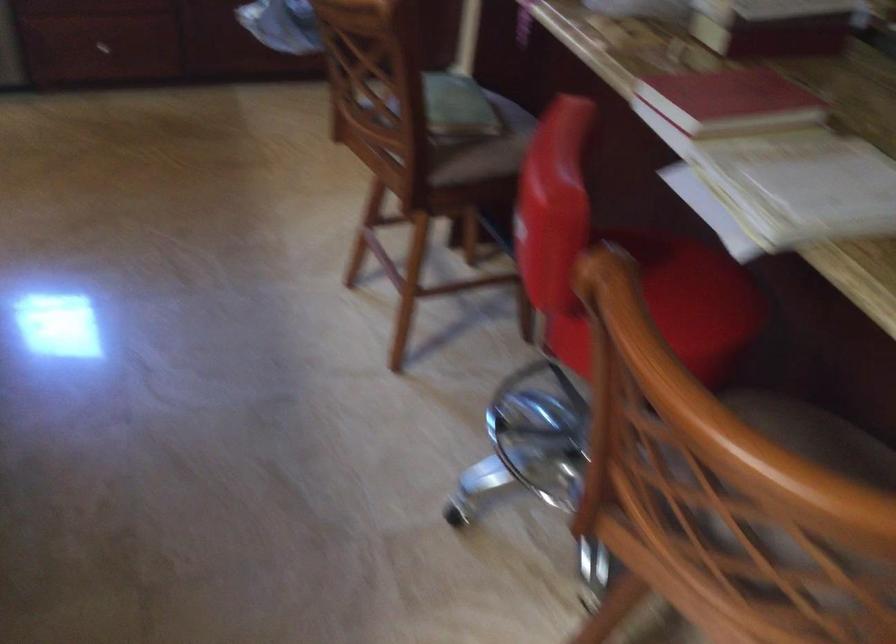
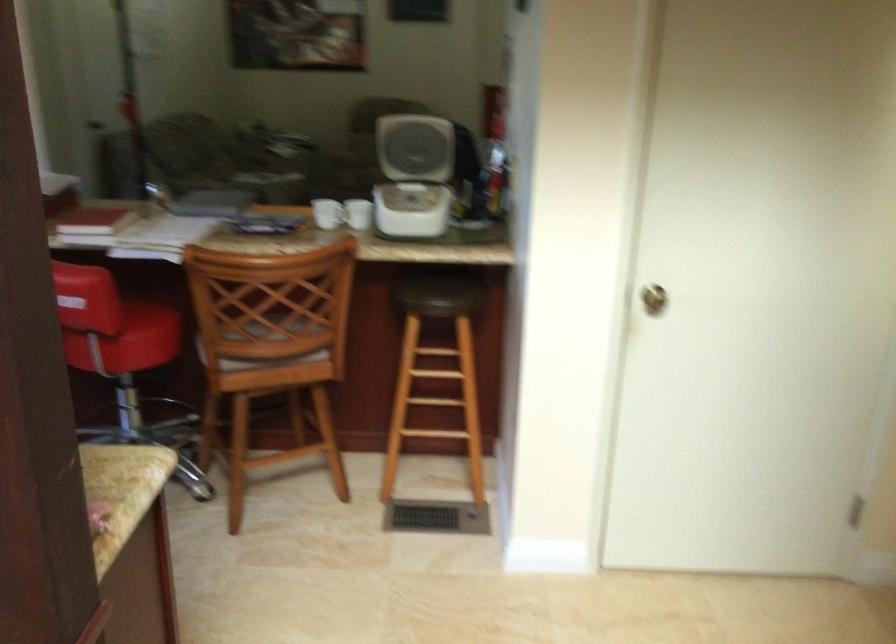
Where in the second image is the point corresponding to the point at 677,104 from the first image?

(93, 223)